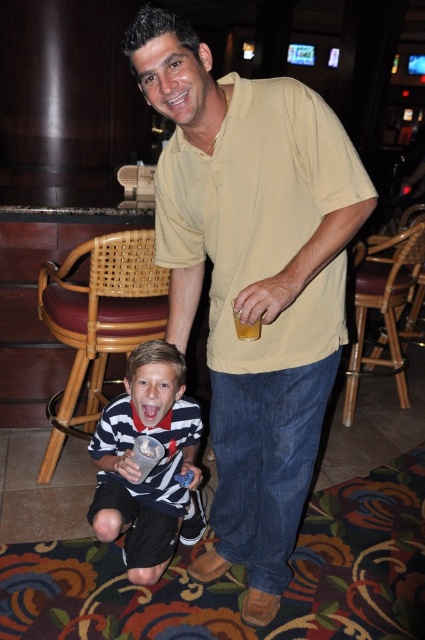
Question: From the image, what is the correct spatial relationship of yellow cotton shirt at center in relation to striped cotton shirt at lower left?

Choices:
 (A) right
 (B) left

Answer: (A)

Question: Can you confirm if yellow cotton shirt at center is positioned above striped cotton shirt at lower left?

Choices:
 (A) yes
 (B) no

Answer: (A)

Question: Which of the following is the closest to the observer?

Choices:
 (A) striped cotton shirt at lower left
 (B) translucent plastic cup at center

Answer: (B)

Question: Can you confirm if yellow cotton shirt at center is positioned above striped cotton shirt at lower left?

Choices:
 (A) yes
 (B) no

Answer: (A)

Question: Estimate the real-world distances between objects in this image. Which object is closer to the striped cotton shirt at lower left?

Choices:
 (A) yellow cotton shirt at center
 (B) translucent plastic cup at center

Answer: (A)

Question: Based on their relative distances, which object is farther from the striped cotton shirt at lower left?

Choices:
 (A) yellow cotton shirt at center
 (B) translucent plastic cup at center

Answer: (B)